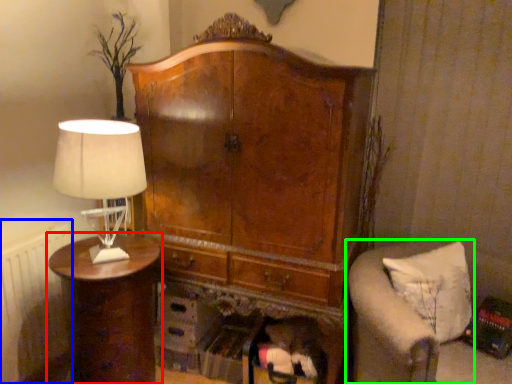
Question: Based on their relative distances, which object is nearer to nightstand (highlighted by a red box)? Choose from radiator (highlighted by a blue box) and furniture (highlighted by a green box).

Choices:
 (A) radiator
 (B) furniture

Answer: (A)